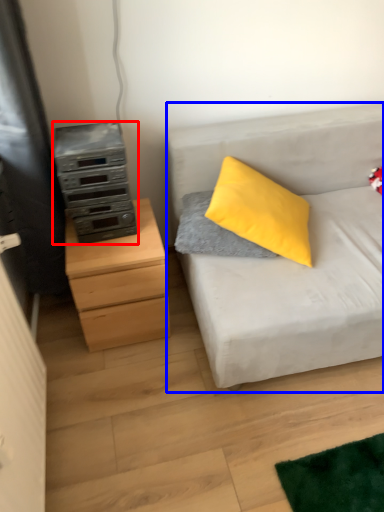
Question: Which of the following is the closest to the observer, appliance (highlighted by a red box) or studio couch (highlighted by a blue box)?

Choices:
 (A) appliance
 (B) studio couch

Answer: (B)